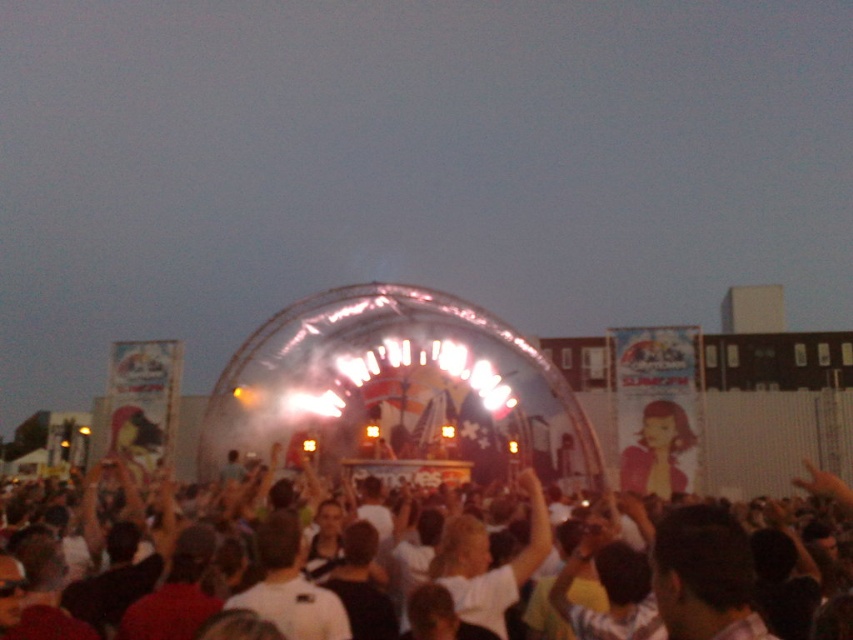
Who is positioned more to the right, white cotton crowd at center or matte pink shirt at center?

Positioned to the right is matte pink shirt at center.

Which is in front, point (322, 600) or point (670, 445)?

Point (322, 600)

Find the location of `white cotton crowd at center`. white cotton crowd at center is located at coordinates (198, 588).